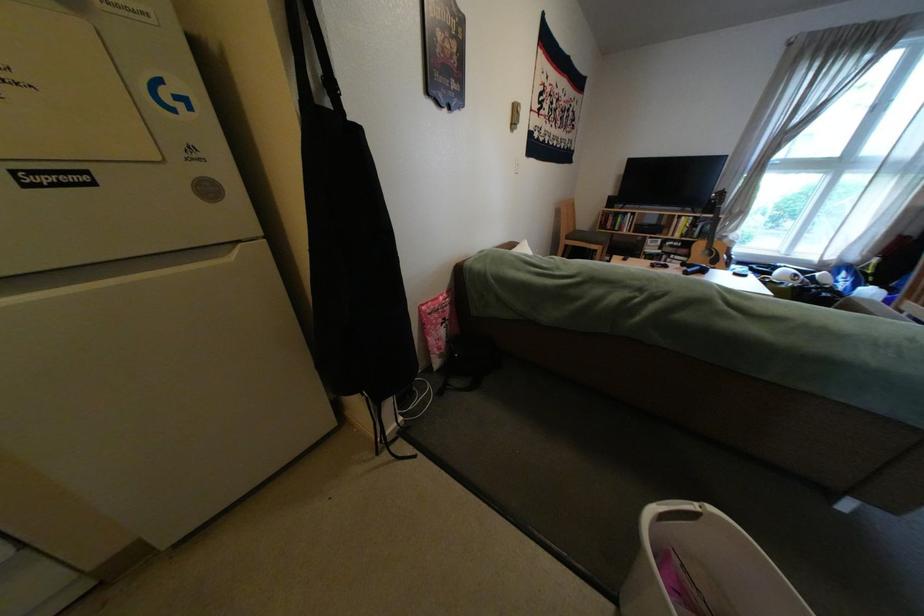
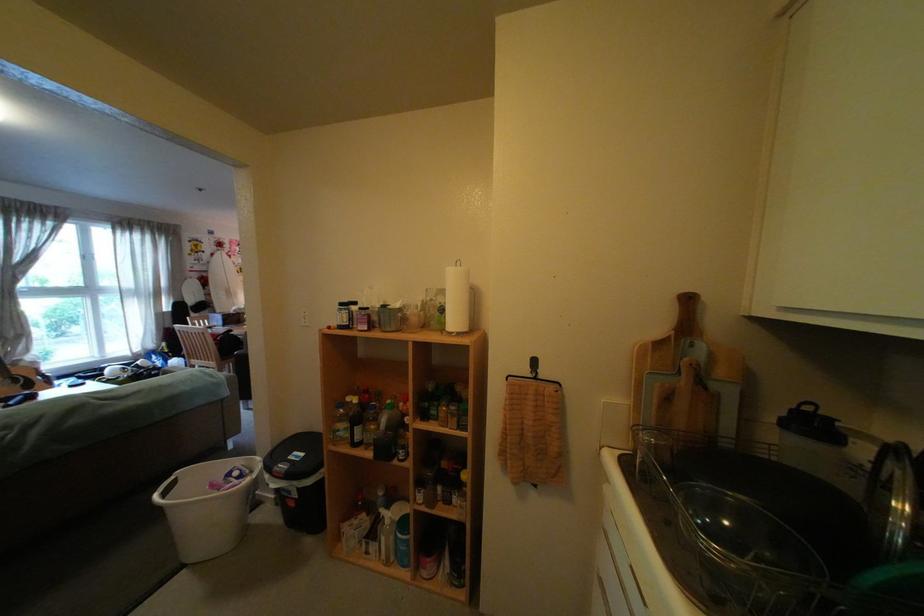
The point at (889, 276) is marked in the first image. Where is the corresponding point in the second image?

(185, 353)